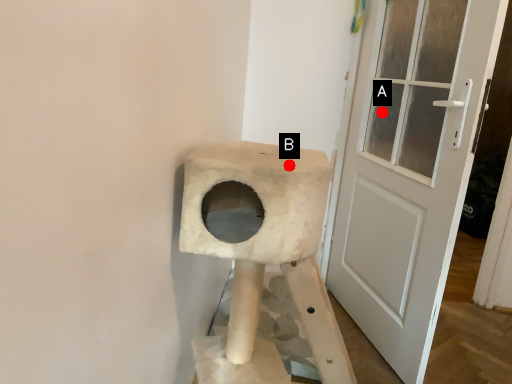
Question: Two points are circled on the image, labeled by A and B beside each circle. Which point is closer to the camera?

Choices:
 (A) A is closer
 (B) B is closer

Answer: (B)